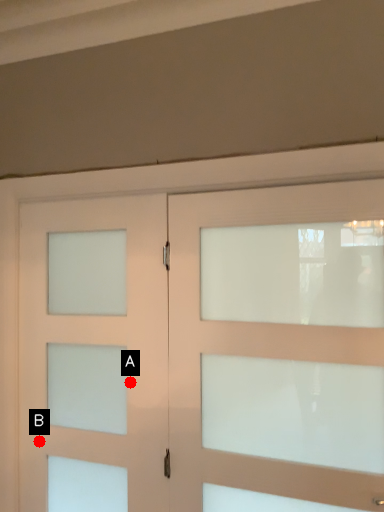
Question: Two points are circled on the image, labeled by A and B beside each circle. Among these points, which one is farthest from the camera?

Choices:
 (A) A is further
 (B) B is further

Answer: (B)